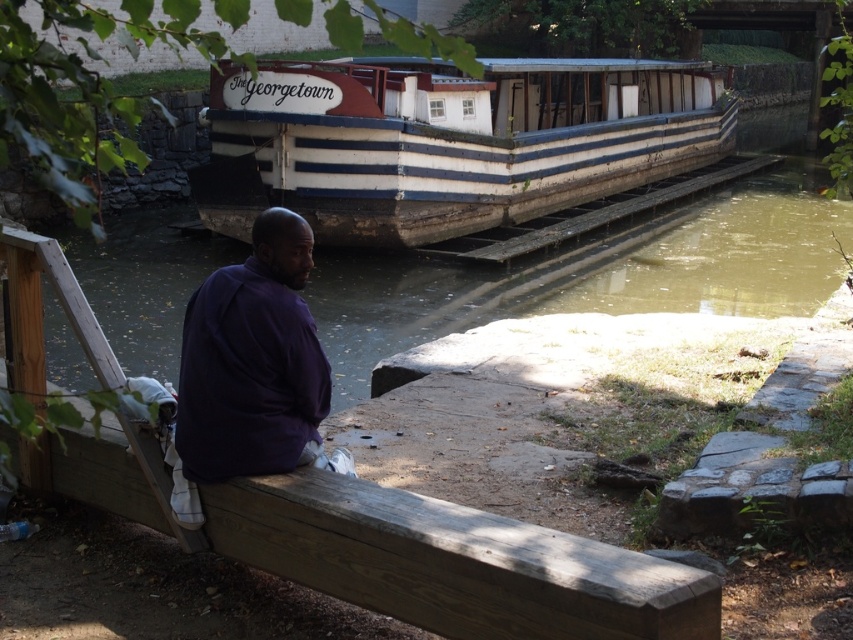
Which is more to the right, wooden dock at center or purple matte shirt at lower left?

wooden dock at center is more to the right.

Can you confirm if wooden dock at center is wider than purple matte shirt at lower left?

Yes.

The image size is (853, 640). In order to click on wooden dock at center in this screenshot , I will do `click(399, 548)`.

Does point (126, 365) lie behind point (258, 428)?

Yes, point (126, 365) is farther from viewer.

Can you confirm if greenish murky water at center is positioned above purple matte shirt at lower left?

Indeed, greenish murky water at center is positioned over purple matte shirt at lower left.

This screenshot has width=853, height=640. Describe the element at coordinates (592, 275) in the screenshot. I see `greenish murky water at center` at that location.

I want to click on greenish murky water at center, so click(x=592, y=275).

Between white painted wood boat at upper center and purple matte shirt at lower left, which one has more height?

Standing taller between the two is white painted wood boat at upper center.

Measure the distance between point (x=308, y=180) and camera.

Point (x=308, y=180) is 16.06 meters away from camera.

The image size is (853, 640). I want to click on white painted wood boat at upper center, so click(x=448, y=141).